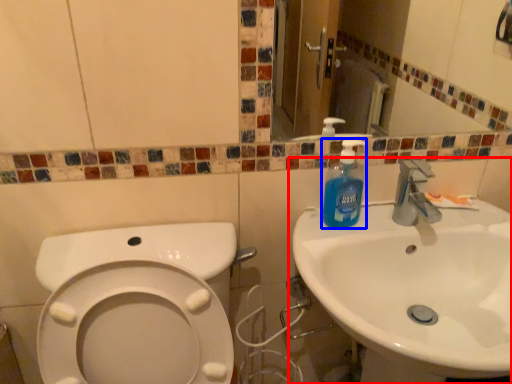
Question: Which object appears farthest to the camera in this image, sink (highlighted by a red box) or cleaning product (highlighted by a blue box)?

Choices:
 (A) sink
 (B) cleaning product

Answer: (B)